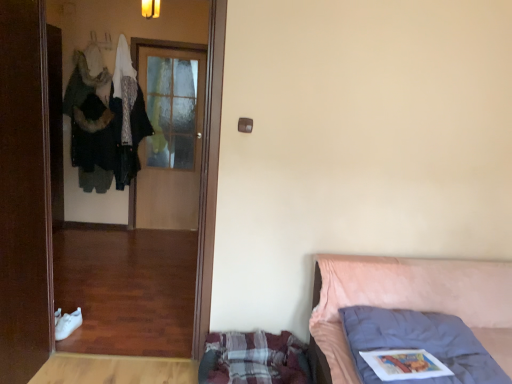
The width and height of the screenshot is (512, 384). Describe the element at coordinates (124, 25) in the screenshot. I see `wooden screen door at left` at that location.

I want to click on brown wooden door at left, marked as the 2th door in a back-to-front arrangement, so click(24, 193).

Locate an element on the screen. The width and height of the screenshot is (512, 384). plaid fabric mattress at lower center is located at coordinates (254, 359).

Based on the photo, is pink fabric bed at right positioned with its back to plaid fabric mattress at lower center?

That's not correct — pink fabric bed at right is not looking away from plaid fabric mattress at lower center.

Is pink fabric bed at right not close to plaid fabric mattress at lower center?

No.

From the image's perspective, is pink fabric bed at right located beneath plaid fabric mattress at lower center?

Incorrect, from the image's perspective, pink fabric bed at right is higher than plaid fabric mattress at lower center.

How different are the orientations of pink fabric bed at right and plaid fabric mattress at lower center in degrees?

4.44e-06 degrees.

Considering the positions of point (483, 335) and point (84, 4), is point (483, 335) closer or farther from the camera than point (84, 4)?

Point (483, 335) appears to be closer to the viewer than point (84, 4).

Between pink fabric bed at right and wooden screen door at left, which one has smaller size?

wooden screen door at left is smaller.

Does pink fabric bed at right have a greater width compared to wooden screen door at left?

Yes, pink fabric bed at right is wider than wooden screen door at left.

From the image's perspective, is plaid fabric mattress at lower center beneath brown wooden door at left, marked as the 2th door in a back-to-front arrangement?

Yes, from the image's perspective, plaid fabric mattress at lower center is below brown wooden door at left, marked as the 2th door in a back-to-front arrangement.

Is plaid fabric mattress at lower center not within brown wooden door at left, the first door from the front?

plaid fabric mattress at lower center lies outside brown wooden door at left, the first door from the front,'s area.

Considering the positions of objects plaid fabric mattress at lower center and brown wooden door at left, the first door from the front, in the image provided, who is in front, plaid fabric mattress at lower center or brown wooden door at left, the first door from the front,?

brown wooden door at left, the first door from the front.

Looking at their sizes, would you say plaid fabric mattress at lower center is wider or thinner than brown wooden door at left, marked as the 2th door in a back-to-front arrangement?

plaid fabric mattress at lower center is wider than brown wooden door at left, marked as the 2th door in a back-to-front arrangement.

Are wooden door at center, which is counted as the second door, starting from the front, and brown wooden door at left, the first door from the front, making contact?

There is a gap between wooden door at center, which is counted as the second door, starting from the front, and brown wooden door at left, the first door from the front.

Could brown wooden door at left, the first door from the front, be considered to be inside wooden door at center, which is counted as the second door, starting from the front?

No, wooden door at center, which is counted as the second door, starting from the front, does not contain brown wooden door at left, the first door from the front.

Which object is closer to the camera, wooden door at center, which is counted as the second door, starting from the front, or brown wooden door at left, marked as the 2th door in a back-to-front arrangement?

brown wooden door at left, marked as the 2th door in a back-to-front arrangement, is more forward.

Could you measure the distance between wooden door at center, marked as the 1th door in a back-to-front arrangement, and brown wooden door at left, the first door from the front?

wooden door at center, marked as the 1th door in a back-to-front arrangement, is 2.55 meters from brown wooden door at left, the first door from the front.

From a real-world perspective, who is located lower, brown wooden door at left, the first door from the front, or plaid fabric mattress at lower center?

plaid fabric mattress at lower center.

Which is more to the left, brown wooden door at left, the first door from the front, or plaid fabric mattress at lower center?

From the viewer's perspective, brown wooden door at left, the first door from the front, appears more on the left side.

Who is smaller, brown wooden door at left, the first door from the front, or plaid fabric mattress at lower center?

Smaller between the two is plaid fabric mattress at lower center.

Is brown wooden door at left, the first door from the front, not near plaid fabric mattress at lower center?

That's right, there is a large distance between brown wooden door at left, the first door from the front, and plaid fabric mattress at lower center.

From the image's perspective, who appears lower, pink fabric bed at right or brown wooden door at left, marked as the 2th door in a back-to-front arrangement?

pink fabric bed at right, from the image's perspective.

Is pink fabric bed at right positioned before brown wooden door at left, the first door from the front?

Yes, pink fabric bed at right is in front of brown wooden door at left, the first door from the front.

Can you confirm if pink fabric bed at right is wider than brown wooden door at left, marked as the 2th door in a back-to-front arrangement?

Yes.

Is pink fabric bed at right touching brown wooden door at left, the first door from the front?

pink fabric bed at right is not next to brown wooden door at left, the first door from the front, and they're not touching.

Does brown wooden door at left, marked as the 2th door in a back-to-front arrangement, have a larger size compared to pink fabric bed at right?

No, brown wooden door at left, marked as the 2th door in a back-to-front arrangement, is not bigger than pink fabric bed at right.

Looking at this image, is pink fabric bed at right a part of brown wooden door at left, the first door from the front?

No, pink fabric bed at right is not a part of brown wooden door at left, the first door from the front.

Which object is further away from the camera taking this photo, brown wooden door at left, the first door from the front, or pink fabric bed at right?

brown wooden door at left, the first door from the front, is further away from the camera.

This screenshot has height=384, width=512. In order to click on mattress located behind the pink fabric bed at right in this screenshot , I will do `click(254, 359)`.

Image resolution: width=512 pixels, height=384 pixels. I want to click on furniture in front of the wooden screen door at left, so click(x=413, y=300).

Looking at the image, which one is located closer to wooden door at center, marked as the 1th door in a back-to-front arrangement, plaid fabric mattress at lower center or wooden screen door at left?

wooden screen door at left lies closer to wooden door at center, marked as the 1th door in a back-to-front arrangement, than the other object.

Looking at the image, which one is located closer to pink fabric bed at right, plaid fabric mattress at lower center or wooden door at center, which is counted as the second door, starting from the front?

Based on the image, plaid fabric mattress at lower center appears to be nearer to pink fabric bed at right.

In the scene shown: Based on their spatial positions, is brown wooden door at left, marked as the 2th door in a back-to-front arrangement, or pink fabric bed at right closer to wooden screen door at left?

brown wooden door at left, marked as the 2th door in a back-to-front arrangement, is positioned closer to the anchor wooden screen door at left.

Looking at the image, which one is located further to plaid fabric mattress at lower center, wooden screen door at left or brown wooden door at left, the first door from the front?

wooden screen door at left is further to plaid fabric mattress at lower center.

Which object lies further to the anchor point pink fabric bed at right, wooden door at center, which is counted as the second door, starting from the front, or plaid fabric mattress at lower center?

Based on the image, wooden door at center, which is counted as the second door, starting from the front, appears to be further to pink fabric bed at right.

In the scene shown: Considering their positions, is wooden screen door at left positioned closer to wooden door at center, which is counted as the second door, starting from the front, than brown wooden door at left, marked as the 2th door in a back-to-front arrangement?

The object closer to wooden door at center, which is counted as the second door, starting from the front, is wooden screen door at left.

Based on the photo, which object lies nearer to the anchor point wooden door at center, which is counted as the second door, starting from the front, wooden screen door at left or plaid fabric mattress at lower center?

wooden screen door at left.

When comparing their distances from brown wooden door at left, marked as the 2th door in a back-to-front arrangement, does pink fabric bed at right or wooden door at center, marked as the 1th door in a back-to-front arrangement, seem closer?

Based on the image, pink fabric bed at right appears to be nearer to brown wooden door at left, marked as the 2th door in a back-to-front arrangement.

I want to click on door between pink fabric bed at right and wooden door at center, marked as the 1th door in a back-to-front arrangement, along the z-axis, so click(24, 193).

You are a GUI agent. You are given a task and a screenshot of the screen. Output one action in this format:
    pyautogui.click(x=<x>, y=<y>)
    Task: Click on the mattress located between brown wooden door at left, the first door from the front, and wooden door at center, which is counted as the second door, starting from the front, in the depth direction
    The image size is (512, 384).
    Given the screenshot: What is the action you would take?
    pyautogui.click(x=254, y=359)

The width and height of the screenshot is (512, 384). Find the location of `screen door between pink fabric bed at right and wooden door at center, which is counted as the second door, starting from the front, from front to back`. screen door between pink fabric bed at right and wooden door at center, which is counted as the second door, starting from the front, from front to back is located at coordinates (124, 25).

Where is `screen door positioned between plaid fabric mattress at lower center and wooden door at center, which is counted as the second door, starting from the front, from near to far`? Image resolution: width=512 pixels, height=384 pixels. screen door positioned between plaid fabric mattress at lower center and wooden door at center, which is counted as the second door, starting from the front, from near to far is located at coordinates (124, 25).